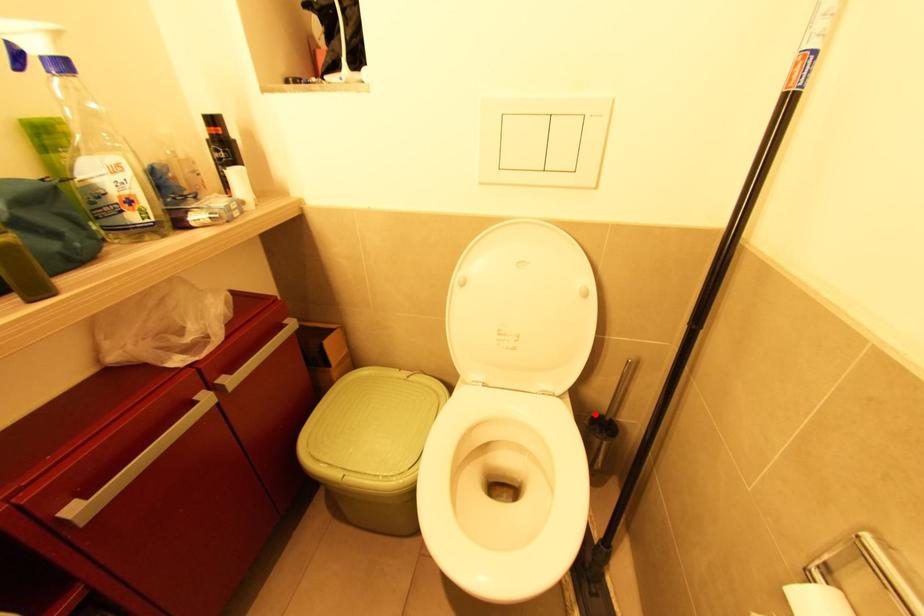
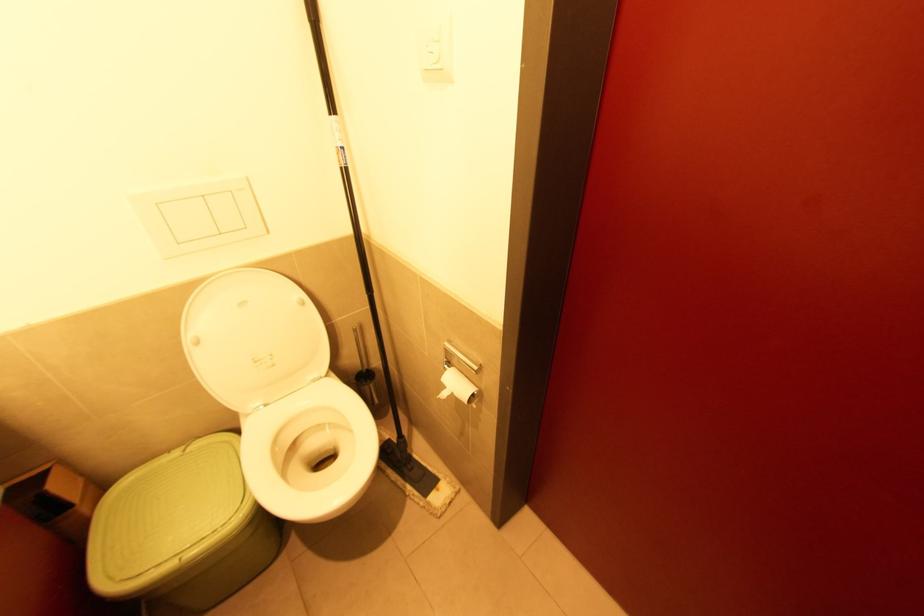
Where in the second image is the point corresponding to the highlighted location from the first image?

(358, 374)